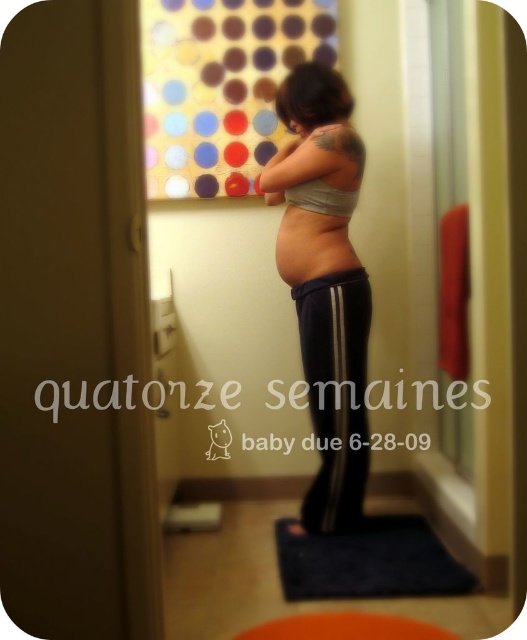
Is navy blue track pants at center above orange rubber mat at lower center?

Correct, navy blue track pants at center is located above orange rubber mat at lower center.

Is point (347, 467) farther from viewer compared to point (360, 614)?

Yes, point (347, 467) is behind point (360, 614).

Between point (356, 468) and point (302, 634), which one is positioned in front?

Positioned in front is point (302, 634).

You are a GUI agent. You are given a task and a screenshot of the screen. Output one action in this format:
    pyautogui.click(x=<x>, y=<y>)
    Task: Click on the navy blue track pants at center
    This screenshot has width=527, height=640.
    Given the screenshot: What is the action you would take?
    pyautogui.click(x=336, y=394)

Between blue soft mat at lower center and orange rubber mat at lower center, which one has less height?

orange rubber mat at lower center is shorter.

Is blue soft mat at lower center above orange rubber mat at lower center?

Indeed, blue soft mat at lower center is positioned over orange rubber mat at lower center.

Find the location of a particular element. The width and height of the screenshot is (527, 640). blue soft mat at lower center is located at coordinates (368, 561).

Locate an element on the screen. This screenshot has height=640, width=527. blue soft mat at lower center is located at coordinates (368, 561).

Who is positioned more to the right, gray matte fabric at center or orange rubber mat at lower center?

orange rubber mat at lower center

The height and width of the screenshot is (640, 527). Identify the location of gray matte fabric at center. (325, 282).